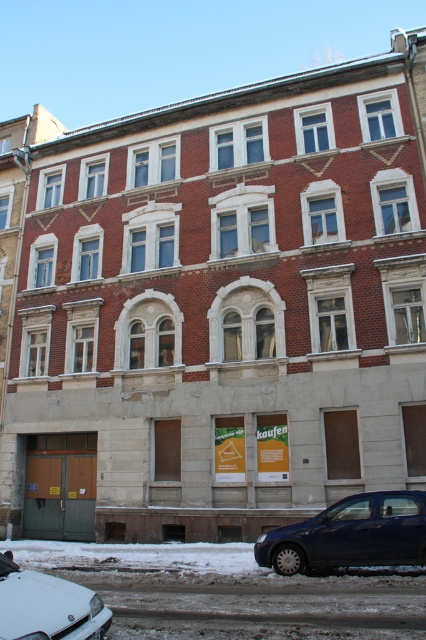
Question: Which point is farther from the camera taking this photo?

Choices:
 (A) (72, 596)
 (B) (380, 550)

Answer: (B)

Question: Is dark blue metallic car at lower right positioned before white matte car at lower left?

Choices:
 (A) yes
 (B) no

Answer: (B)

Question: Is dark blue metallic car at lower right to the right of white matte car at lower left from the viewer's perspective?

Choices:
 (A) yes
 (B) no

Answer: (A)

Question: Can you confirm if dark blue metallic car at lower right is smaller than white matte car at lower left?

Choices:
 (A) yes
 (B) no

Answer: (B)

Question: Among these points, which one is nearest to the camera?

Choices:
 (A) (327, 522)
 (B) (5, 593)

Answer: (B)